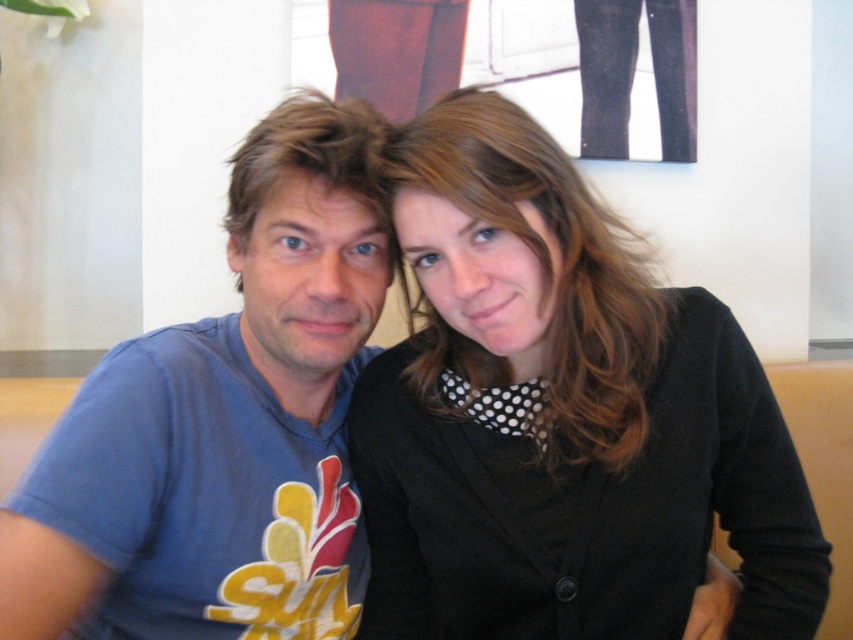
You are a fashion designer observing two people in a casual setting. You need to determine which item of clothing or accessory is bigger between the black matte cardigan at center and the brownhair at left. Which one is larger?

The black matte cardigan at center is larger than the brownhair at left.

You are trying to determine which of the two points, point (485, 454) or point (263, 140), is nearer to you in the image. Based on the scene description, which point is closer?

Point (485, 454) is closer to the viewer than point (263, 140).